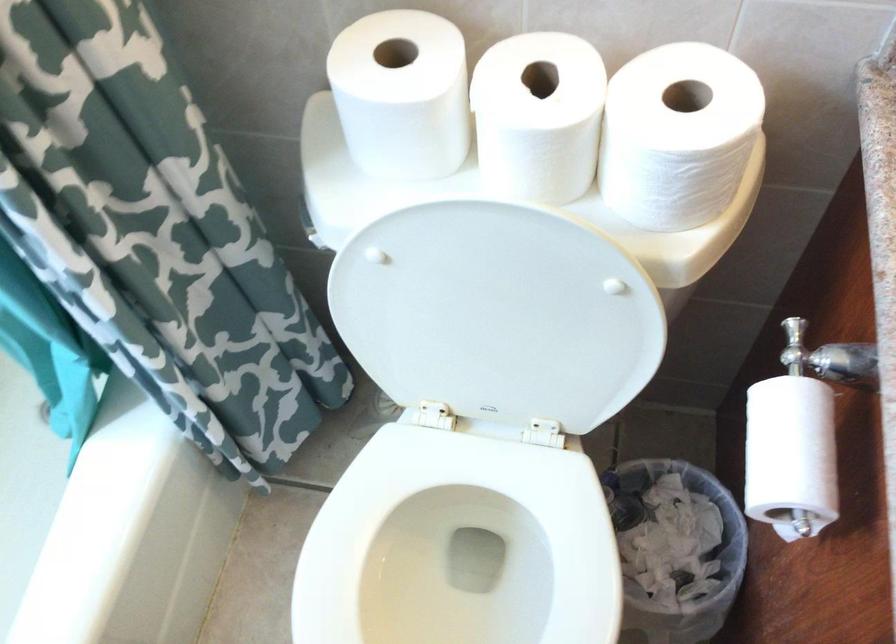
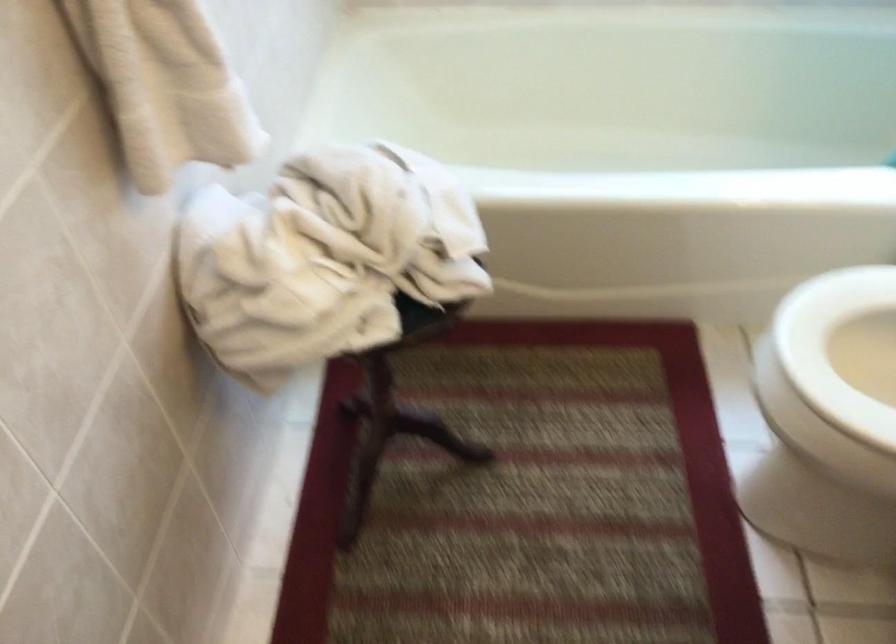
The images are taken continuously from a first-person perspective. In which direction is your viewpoint rotating?

The camera rotated toward left-down.